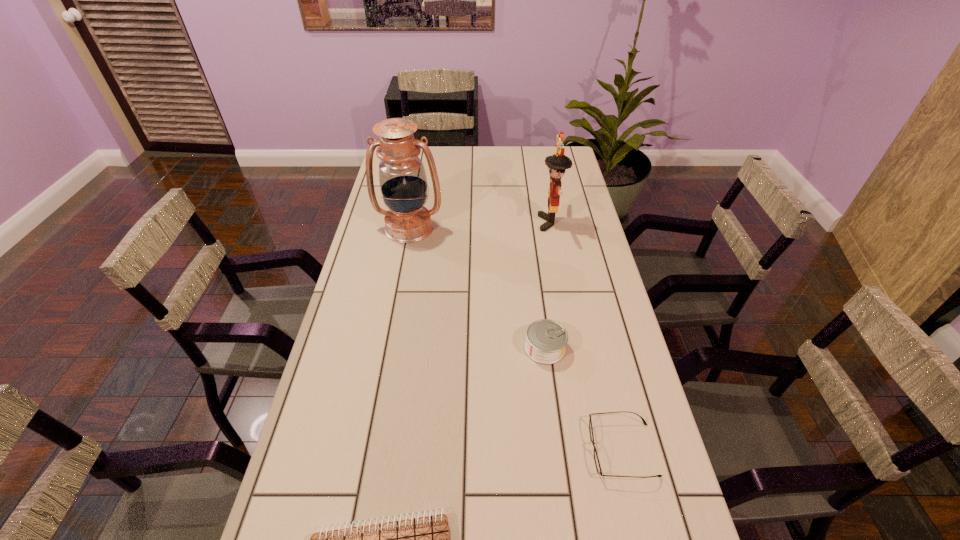
Identify the location of vacant area that satisfies the following two spatial constraints: 1. on the front-facing side of the nutcracker; 2. on the front side of the oil lamp. (551, 227).